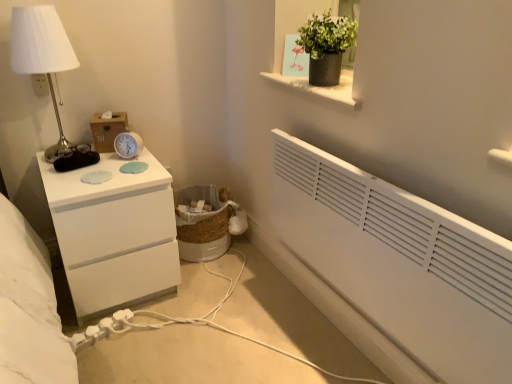
Question: Is woven natural laundry basket at lower center turned away from white plastic alarm clock at upper left?

Choices:
 (A) no
 (B) yes

Answer: (A)

Question: Is woven natural laundry basket at lower center bigger than white plastic alarm clock at upper left?

Choices:
 (A) yes
 (B) no

Answer: (A)

Question: Considering the relative positions of woven natural laundry basket at lower center and white plastic alarm clock at upper left in the image provided, is woven natural laundry basket at lower center behind white plastic alarm clock at upper left?

Choices:
 (A) no
 (B) yes

Answer: (B)

Question: Is white plastic alarm clock at upper left located within woven natural laundry basket at lower center?

Choices:
 (A) yes
 (B) no

Answer: (B)

Question: From the image's perspective, does woven natural laundry basket at lower center appear higher than white plastic alarm clock at upper left?

Choices:
 (A) yes
 (B) no

Answer: (B)

Question: Looking at their shapes, would you say wooden tissue box at upper left is wider or thinner than white metallic table lamp at left?

Choices:
 (A) thin
 (B) wide

Answer: (A)

Question: From their relative heights in the image, would you say wooden tissue box at upper left is taller or shorter than white metallic table lamp at left?

Choices:
 (A) tall
 (B) short

Answer: (B)

Question: Considering the positions of wooden tissue box at upper left and white metallic table lamp at left in the image, is wooden tissue box at upper left bigger or smaller than white metallic table lamp at left?

Choices:
 (A) big
 (B) small

Answer: (B)

Question: From the image's perspective, is wooden tissue box at upper left located above or below white metallic table lamp at left?

Choices:
 (A) above
 (B) below

Answer: (B)

Question: Relative to white plastic electric outlet at upper left, is wooden tissue box at upper left in front or behind?

Choices:
 (A) behind
 (B) front

Answer: (A)

Question: Considering the positions of point (106, 135) and point (34, 82), is point (106, 135) closer or farther from the camera than point (34, 82)?

Choices:
 (A) farther
 (B) closer

Answer: (A)

Question: From the image's perspective, is wooden tissue box at upper left located above or below white plastic electric outlet at upper left?

Choices:
 (A) below
 (B) above

Answer: (A)

Question: Choose the correct answer: Is wooden tissue box at upper left inside white plastic electric outlet at upper left or outside it?

Choices:
 (A) inside
 (B) outside

Answer: (B)

Question: In terms of height, does white plastic electric outlet at upper left look taller or shorter compared to wooden tissue box at upper left?

Choices:
 (A) tall
 (B) short

Answer: (B)

Question: In terms of size, does white plastic electric outlet at upper left appear bigger or smaller than wooden tissue box at upper left?

Choices:
 (A) big
 (B) small

Answer: (B)